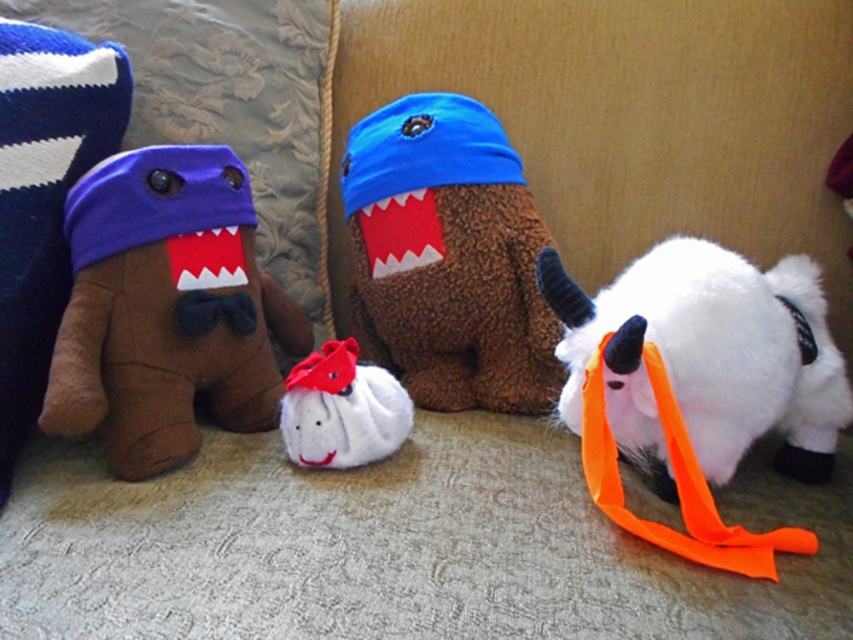
You are standing in the scene and want to pick up the object at point [64,314]. Is this point closer to you than the point [741,378]?

Yes, the point [64,314] is closer to you than the point [741,378] because it is further to the camera.

You are standing in the room and want to place a new toy exactly at coordinate point 0.5, 0.2. Considering the existing brown plush toy at left, is this coordinate available?

The brown plush toy at left is already positioned at point (166, 308), which is very close to the desired coordinate (170, 320). Depending on the exact placement, there might be minimal space, but the coordinate is technically available unless the toy occupies the exact point.